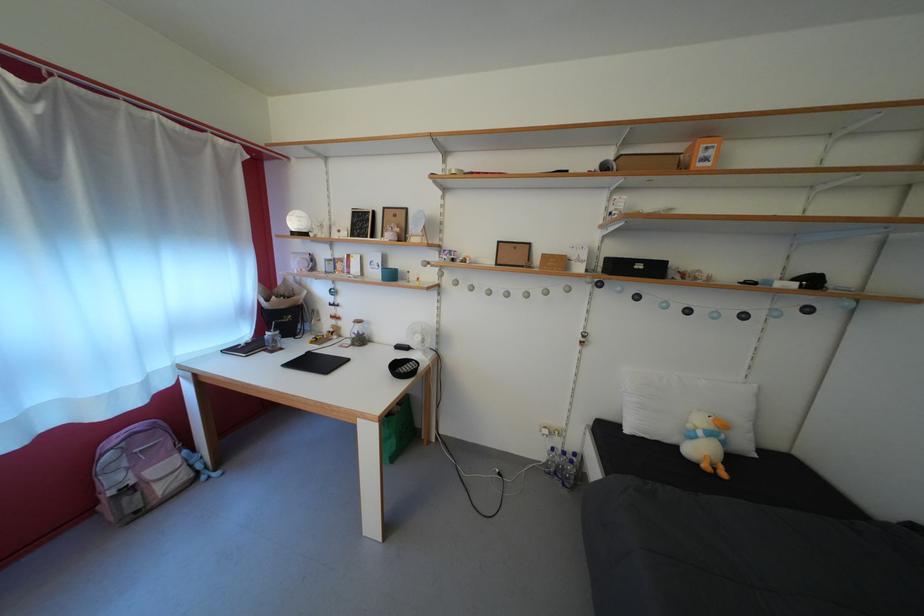
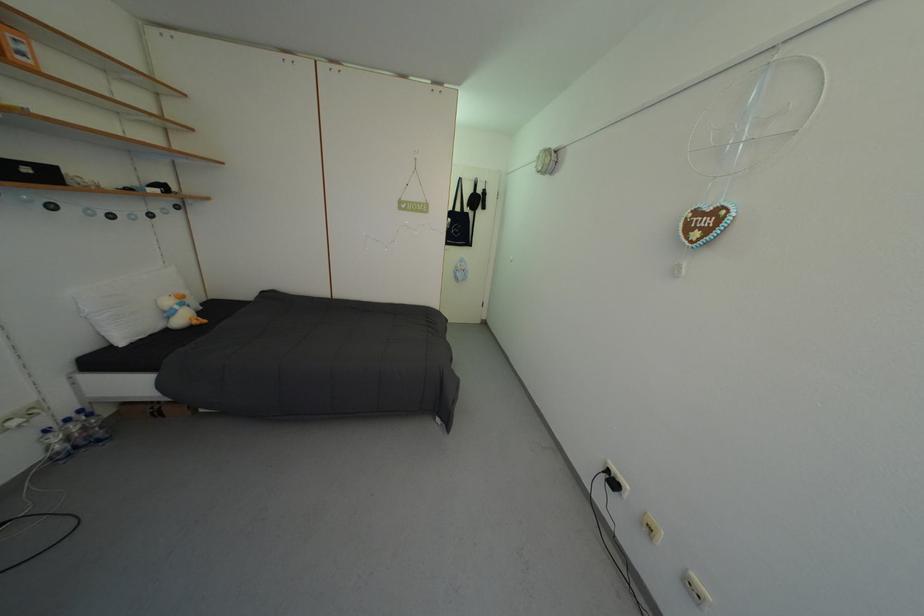
Locate, in the second image, the point that corresponds to pixel 573 459 in the first image.

(76, 426)